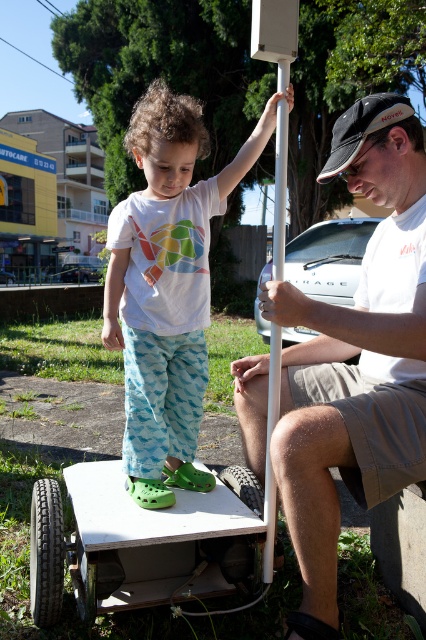
Question: Is white cotton shirt at center to the right of white plastic pole at center from the viewer's perspective?

Choices:
 (A) no
 (B) yes

Answer: (A)

Question: Based on their relative distances, which object is farther from the white cotton shirt at center?

Choices:
 (A) white matte pole at center
 (B) white plastic pole at center

Answer: (B)

Question: Does white cotton shirt at center lie behind white plastic pole at center?

Choices:
 (A) yes
 (B) no

Answer: (A)

Question: Among these points, which one is farthest from the camera?

Choices:
 (A) (265, 516)
 (B) (132, 488)
 (C) (365, 465)

Answer: (B)

Question: Which object is positioned closest to the white matte pole at center?

Choices:
 (A) white cotton shirt at center
 (B) white plastic pole at center

Answer: (B)

Question: Can you confirm if white matte pole at center is positioned below white plastic pole at center?

Choices:
 (A) no
 (B) yes

Answer: (A)